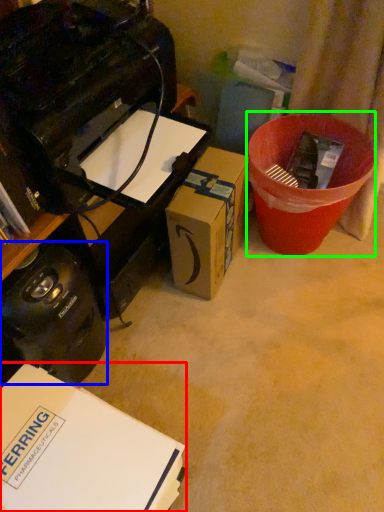
Question: Which object is positioned farthest from box (highlighted by a red box)? Select from appliance (highlighted by a blue box) and recycling bin (highlighted by a green box).

Choices:
 (A) appliance
 (B) recycling bin

Answer: (B)